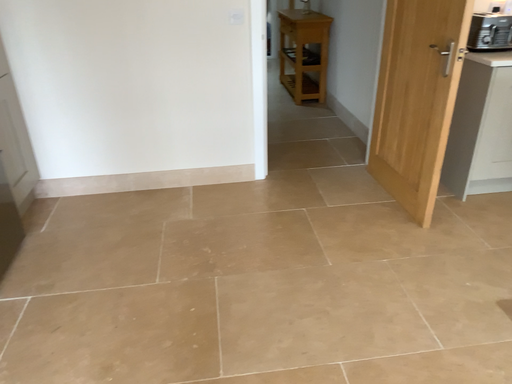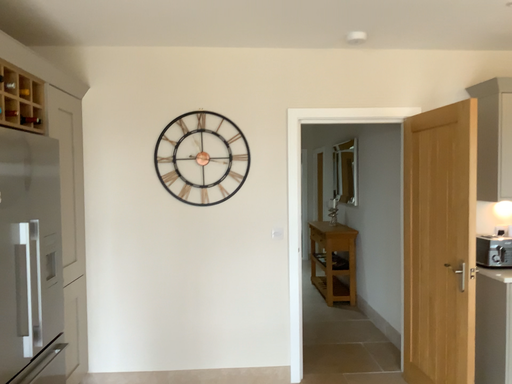
Question: How did the camera likely rotate when shooting the video?

Choices:
 (A) rotated downward
 (B) rotated upward

Answer: (B)